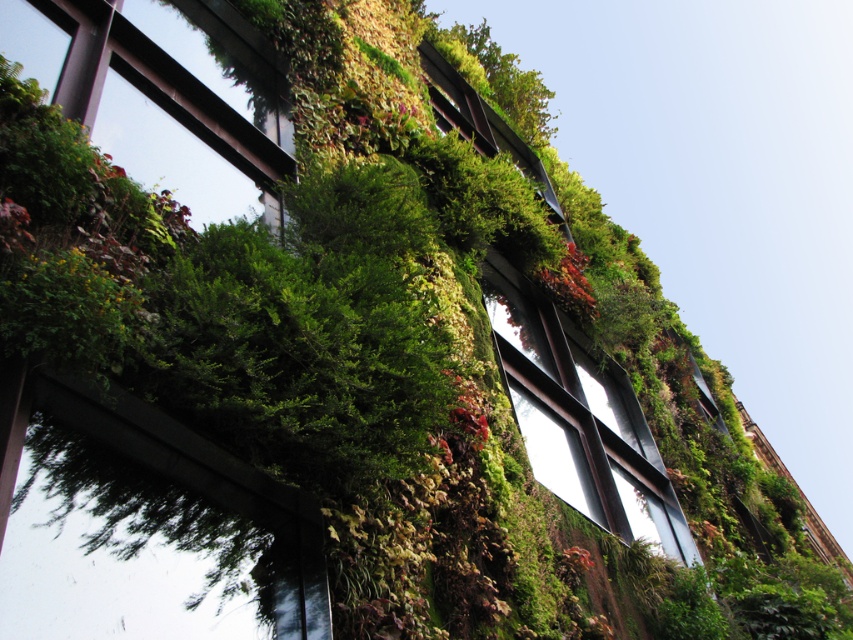
Question: Which point appears farthest from the camera in this image?

Choices:
 (A) (71, 19)
 (B) (630, 433)

Answer: (B)

Question: In this image, where is metallic glass window at center located relative to green matte window at upper left?

Choices:
 (A) below
 (B) above

Answer: (A)

Question: Does metallic glass window at center appear under green matte window at upper left?

Choices:
 (A) no
 (B) yes

Answer: (B)

Question: Is metallic glass window at center below green matte window at upper left?

Choices:
 (A) yes
 (B) no

Answer: (A)

Question: Which object appears farthest from the camera in this image?

Choices:
 (A) green matte window at upper left
 (B) metallic glass window at center

Answer: (B)